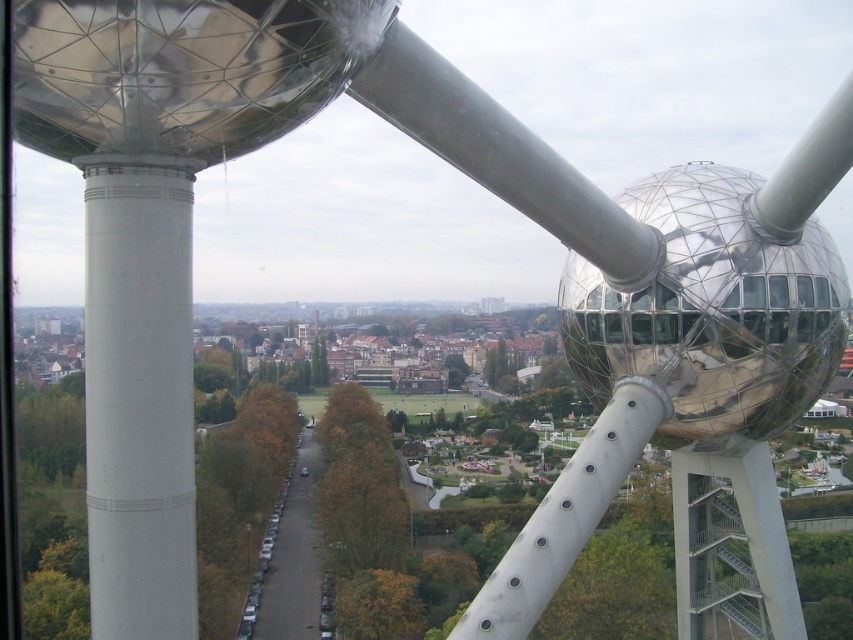
Does polished metallic sphere at right appear over white smooth pillar at left?

Correct, polished metallic sphere at right is located above white smooth pillar at left.

Between polished metallic sphere at right and white smooth pillar at left, which one has less height?

Standing shorter between the two is polished metallic sphere at right.

What do you see at coordinates (711, 312) in the screenshot? Image resolution: width=853 pixels, height=640 pixels. I see `polished metallic sphere at right` at bounding box center [711, 312].

You are a GUI agent. You are given a task and a screenshot of the screen. Output one action in this format:
    pyautogui.click(x=<x>, y=<y>)
    Task: Click on the polished metallic sphere at right
    This screenshot has width=853, height=640.
    Given the screenshot: What is the action you would take?
    pyautogui.click(x=711, y=312)

Does polished metallic sphere at right appear under white metallic pole at center?

No, polished metallic sphere at right is not below white metallic pole at center.

Is point (735, 330) farther from camera compared to point (654, 428)?

No, it is in front of (654, 428).

Identify the location of polished metallic sphere at right. (711, 312).

Does white smooth pillar at left appear on the left side of white metallic pole at center?

Correct, you'll find white smooth pillar at left to the left of white metallic pole at center.

Between point (173, 396) and point (614, 429), which one is positioned in front?

Point (173, 396)

Find the location of a particular element. The width and height of the screenshot is (853, 640). white smooth pillar at left is located at coordinates (138, 396).